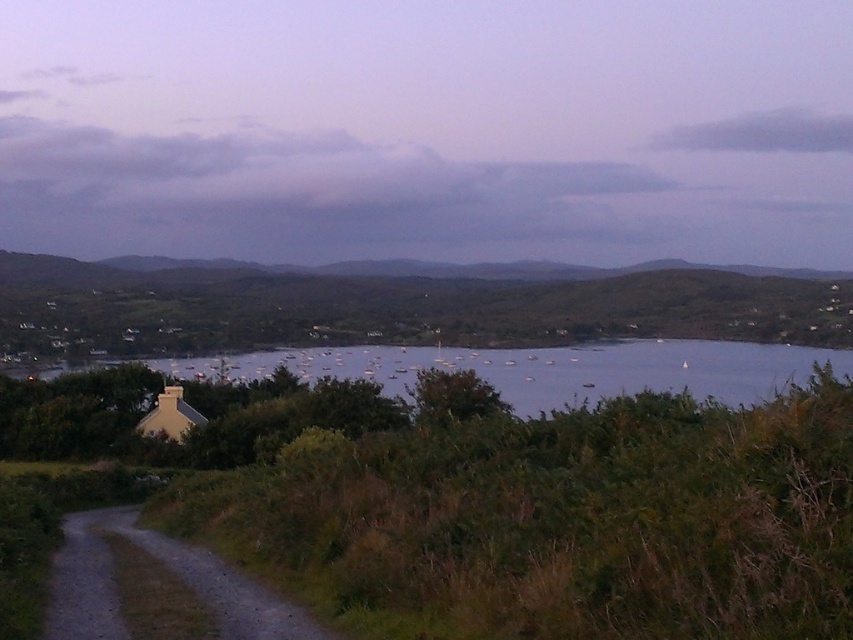
Based on the photo, you are standing on the dirt path and want to take a photo of the cloudy sky at upper center and the green grassy hillside at center. Which object will appear closer to the camera in the photo?

The cloudy sky at upper center will appear closer to the camera in the photo because the green grassy hillside at center is positioned behind it.

You are standing on the dirt path and want to look at both the cloudy sky at upper center and the clear water at center. Which object will you need to look further away from you?

The clear water at center is further away from you than the cloudy sky at upper center, so you need to look further to see the clear water at center.